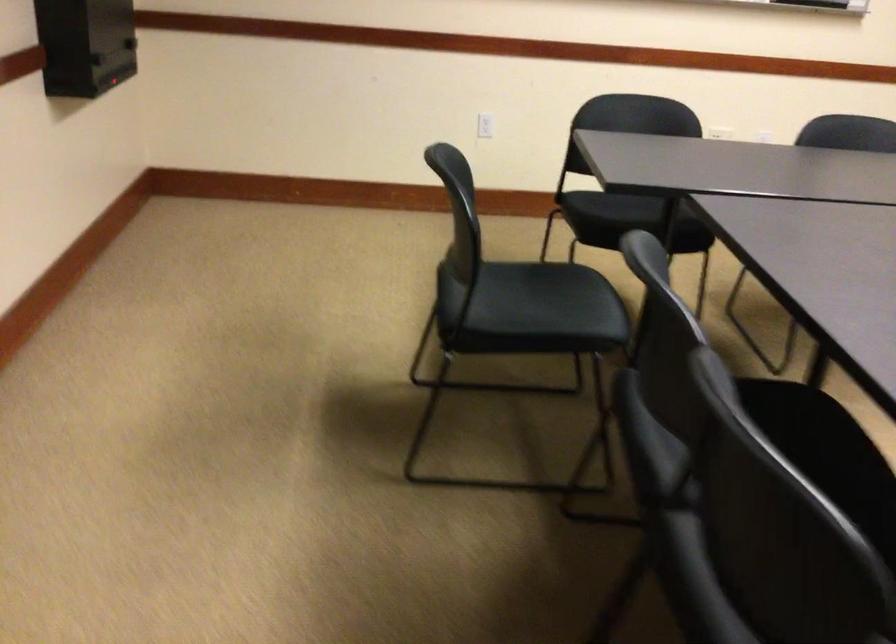
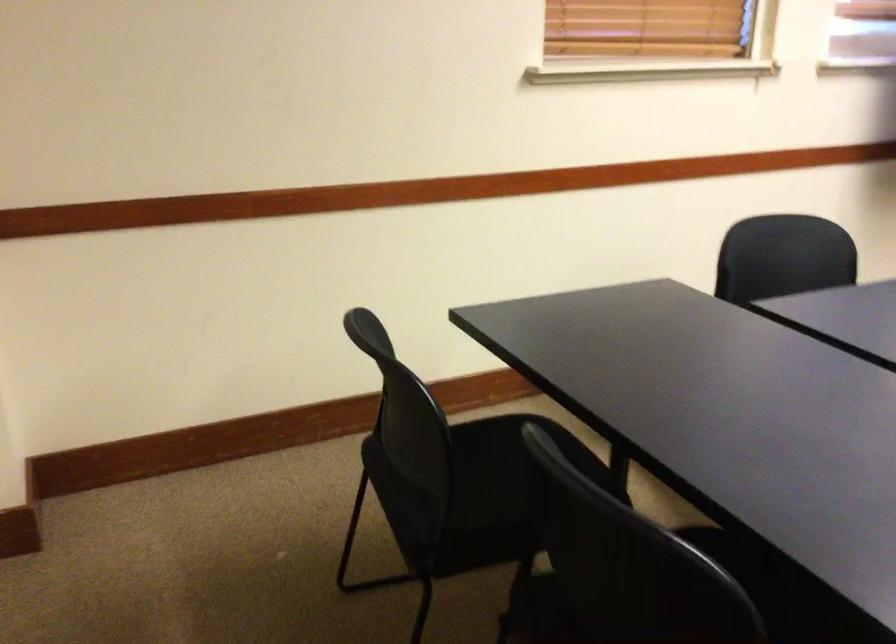
Question: What movement of the cameraman would produce the second image?

Choices:
 (A) Left
 (B) Right
 (C) Forward
 (D) Backward

Answer: (D)